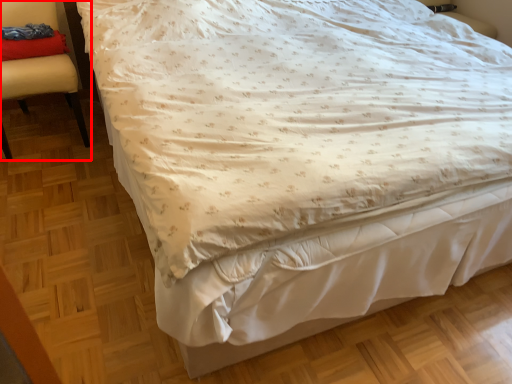
Question: From the image's perspective, what is the correct spatial relationship of chair (annotated by the red box) in relation to pillow?

Choices:
 (A) above
 (B) below

Answer: (B)